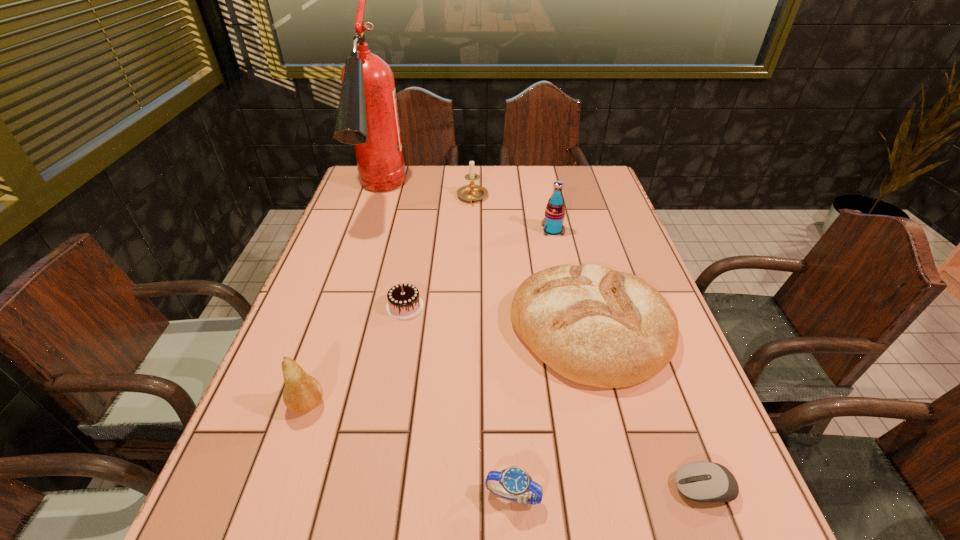
Where is `candle holder that is positioned at the far edge`? candle holder that is positioned at the far edge is located at coordinates (471, 192).

This screenshot has height=540, width=960. In order to click on fire extinguisher that is at the left edge in this screenshot , I will do `click(367, 117)`.

Find the location of a particular element. pear situated at the left edge is located at coordinates (302, 393).

The image size is (960, 540). I want to click on bread positioned at the right edge, so click(596, 326).

The image size is (960, 540). What are the coordinates of `computer equipment present at the right edge` in the screenshot? It's located at (705, 482).

Locate an element on the screen. object located at the far left corner is located at coordinates (367, 117).

The image size is (960, 540). Identify the location of vacant space at the far edge of the desktop. (546, 188).

Image resolution: width=960 pixels, height=540 pixels. In the image, there is a desktop. What are the coordinates of `vacant space at the left edge` in the screenshot? It's located at (x=353, y=202).

Image resolution: width=960 pixels, height=540 pixels. Find the location of `free location at the right edge of the desktop`. free location at the right edge of the desktop is located at coordinates (612, 242).

The height and width of the screenshot is (540, 960). I want to click on blank area at the far left corner, so click(x=345, y=199).